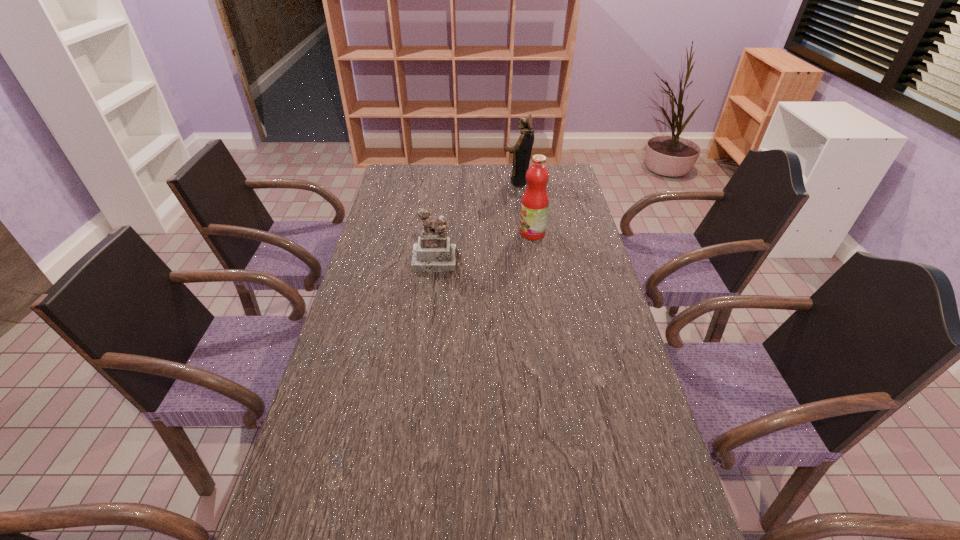
The image size is (960, 540). Find the location of `free space located on the front label of the second farthest object`. free space located on the front label of the second farthest object is located at coordinates (500, 233).

At what (x,y) coordinates should I click in order to perform the action: click on free space located on the front-facing side of the nearest object. Please return your answer as a coordinate pair (x, y). Looking at the image, I should click on (427, 333).

Find the location of a particular element. object positioned at the far edge is located at coordinates (522, 149).

At what (x,y) coordinates should I click in order to perform the action: click on object that is at the right edge. Please return your answer as a coordinate pair (x, y). The image size is (960, 540). Looking at the image, I should click on 534,206.

Image resolution: width=960 pixels, height=540 pixels. Identify the location of free space at the far edge of the desktop. (479, 164).

Image resolution: width=960 pixels, height=540 pixels. In the image, there is a desktop. Identify the location of vacant space at the left edge. (372, 369).

At what (x,y) coordinates should I click in order to perform the action: click on vacant space at the right edge of the desktop. Please return your answer as a coordinate pair (x, y). The width and height of the screenshot is (960, 540). Looking at the image, I should click on (557, 224).

Find the location of a particular element. The width and height of the screenshot is (960, 540). vacant space at the far right corner of the desktop is located at coordinates (568, 170).

You are a GUI agent. You are given a task and a screenshot of the screen. Output one action in this format:
    pyautogui.click(x=<x>, y=<y>)
    Task: Click on the vacant space that's between the taller figurine and the left figurine
    The image size is (960, 540).
    Given the screenshot: What is the action you would take?
    pyautogui.click(x=476, y=221)

Locate an element on the screen. blank region between the farthest object and the nearest object is located at coordinates (476, 221).